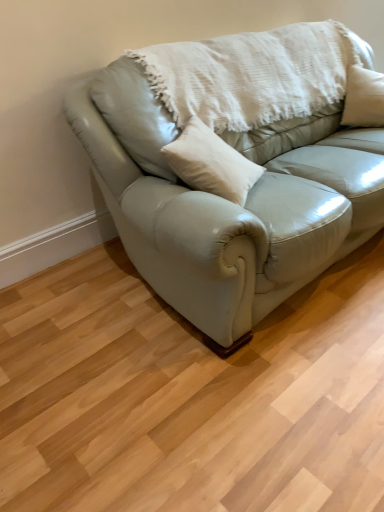
Locate an element on the screen. white textured blanket at upper center is located at coordinates (254, 74).

Describe the element at coordinates (254, 74) in the screenshot. I see `white textured blanket at upper center` at that location.

What do you see at coordinates (235, 166) in the screenshot? This screenshot has height=512, width=384. I see `light gray leather couch at center` at bounding box center [235, 166].

You are a GUI agent. You are given a task and a screenshot of the screen. Output one action in this format:
    pyautogui.click(x=<x>, y=<y>)
    Task: Click on the light gray leather couch at center
    Image resolution: width=384 pixels, height=512 pixels.
    Given the screenshot: What is the action you would take?
    pyautogui.click(x=235, y=166)

What are the coordinates of `white textured blanket at upper center` in the screenshot? It's located at (254, 74).

Considering the relative positions of white textured blanket at upper center and light gray leather couch at center in the image provided, is white textured blanket at upper center to the left of light gray leather couch at center from the viewer's perspective?

Yes.

Relative to light gray leather couch at center, is white textured blanket at upper center in front or behind?

white textured blanket at upper center is behind light gray leather couch at center.

Between point (198, 106) and point (231, 265), which one is positioned behind?

The point (198, 106) is more distant.

From the image's perspective, is white textured blanket at upper center positioned above or below light gray leather couch at center?

white textured blanket at upper center is situated higher than light gray leather couch at center in the image.

Looking at this image, from a real-world perspective, is white textured blanket at upper center over light gray leather couch at center?

Yes.

In the scene shown: Considering the relative sizes of white textured blanket at upper center and light gray leather couch at center in the image provided, is white textured blanket at upper center wider than light gray leather couch at center?

No.

Does white textured blanket at upper center have a greater height compared to light gray leather couch at center?

Incorrect, the height of white textured blanket at upper center is not larger of that of light gray leather couch at center.

Does white textured blanket at upper center have a larger size compared to light gray leather couch at center?

Actually, white textured blanket at upper center might be smaller than light gray leather couch at center.

Is white textured blanket at upper center inside or outside of light gray leather couch at center?

white textured blanket at upper center is inside light gray leather couch at center.

Is white textured blanket at upper center beside light gray leather couch at center?

No, white textured blanket at upper center is not next to light gray leather couch at center.

Is white textured blanket at upper center oriented away from light gray leather couch at center?

A: Yes, white textured blanket at upper center's orientation is away from light gray leather couch at center.

Based on the photo, what's the angular difference between white textured blanket at upper center and light gray leather couch at center's facing directions?

The angular difference between white textured blanket at upper center and light gray leather couch at center is 0.529 degrees.

How much distance is there between white textured blanket at upper center and light gray leather couch at center?

The distance of white textured blanket at upper center from light gray leather couch at center is 8.06 inches.

This screenshot has width=384, height=512. What are the coordinates of `studio couch on the right of white textured blanket at upper center` in the screenshot? It's located at (235, 166).

Which object is positioned more to the left, light gray leather couch at center or white textured blanket at upper center?

From the viewer's perspective, white textured blanket at upper center appears more on the left side.

Is light gray leather couch at center in front of or behind white textured blanket at upper center in the image?

Visually, light gray leather couch at center is located in front of white textured blanket at upper center.

Does point (124, 71) appear closer or farther from the camera than point (214, 42)?

Point (124, 71) is closer to the camera than point (214, 42).

From the image's perspective, which object appears higher, light gray leather couch at center or white textured blanket at upper center?

From the image's view, white textured blanket at upper center is above.

From a real-world perspective, is light gray leather couch at center positioned over white textured blanket at upper center based on gravity?

No.

Considering the relative sizes of light gray leather couch at center and white textured blanket at upper center in the image provided, is light gray leather couch at center thinner than white textured blanket at upper center?

Incorrect, the width of light gray leather couch at center is not less than that of white textured blanket at upper center.

In terms of height, does light gray leather couch at center look taller or shorter compared to white textured blanket at upper center?

Considering their sizes, light gray leather couch at center has more height than white textured blanket at upper center.

Between light gray leather couch at center and white textured blanket at upper center, which one has larger size?

With larger size is light gray leather couch at center.

Would you say white textured blanket at upper center is part of light gray leather couch at center's contents?

Yes, white textured blanket at upper center can be found within light gray leather couch at center.

Is light gray leather couch at center not near white textured blanket at upper center?

No, light gray leather couch at center is not far from white textured blanket at upper center.

Is light gray leather couch at center looking in the opposite direction of white textured blanket at upper center?

Yes.

How many degrees apart are the facing directions of light gray leather couch at center and white textured blanket at upper center?

light gray leather couch at center and white textured blanket at upper center are facing 0.529 degrees away from each other.

At what (x,y) coordinates should I click in order to perform the action: click on studio couch on the right of white textured blanket at upper center. Please return your answer as a coordinate pair (x, y). The height and width of the screenshot is (512, 384). Looking at the image, I should click on (235, 166).

The width and height of the screenshot is (384, 512). I want to click on studio couch directly beneath the white textured blanket at upper center (from a real-world perspective), so click(x=235, y=166).

There is a light gray leather couch at center. At what (x,y) coordinates should I click in order to perform the action: click on blanket above it (from a real-world perspective). Please return your answer as a coordinate pair (x, y). Looking at the image, I should click on (254, 74).